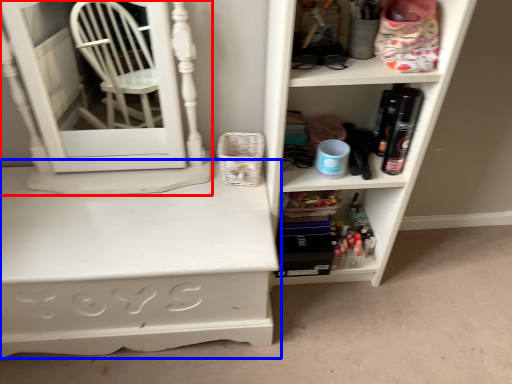
Question: Which object is closer to the camera taking this photo, medicine cabinet (highlighted by a red box) or desk (highlighted by a blue box)?

Choices:
 (A) medicine cabinet
 (B) desk

Answer: (A)